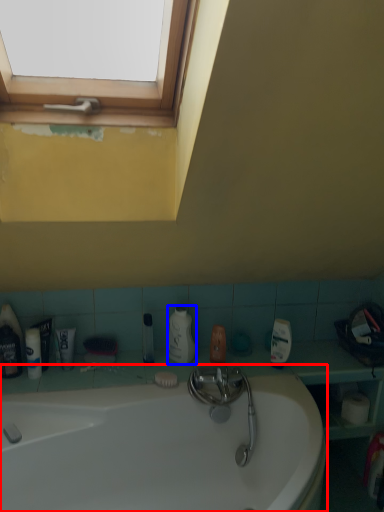
Question: Which object appears closest to the camera in this image, bathtub (highlighted by a red box) or cleaning product (highlighted by a blue box)?

Choices:
 (A) bathtub
 (B) cleaning product

Answer: (A)